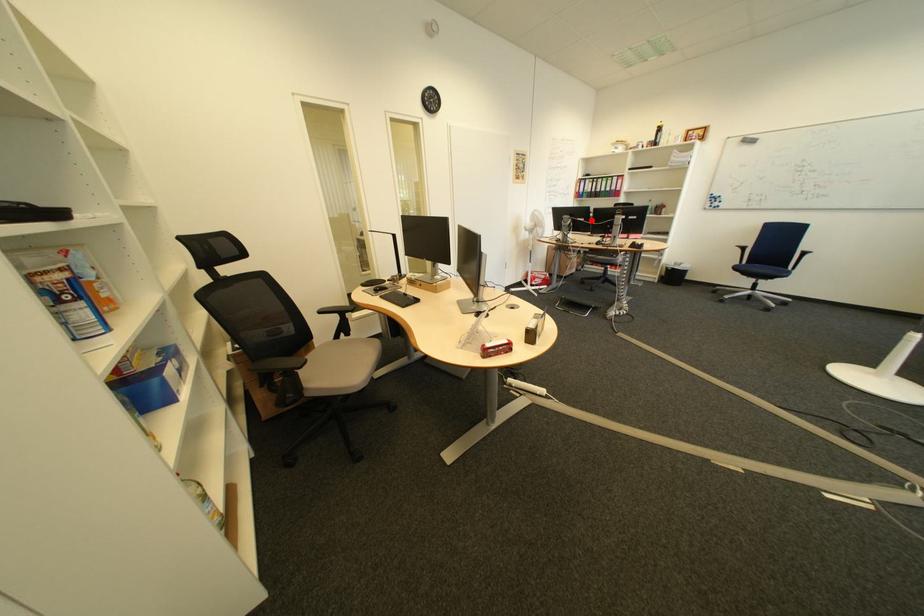
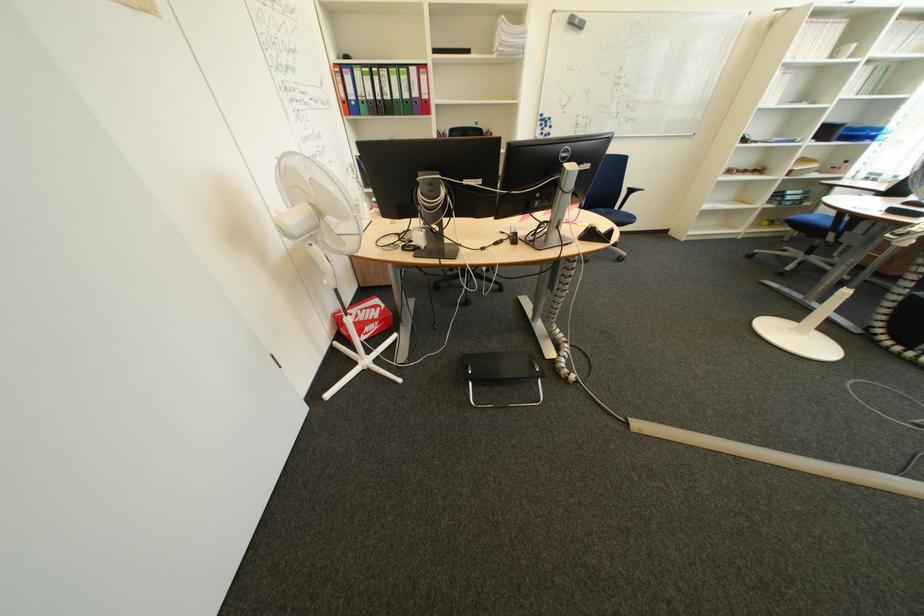
Locate, in the second image, the point that corresponds to the highlighted location in the first image.

(479, 184)